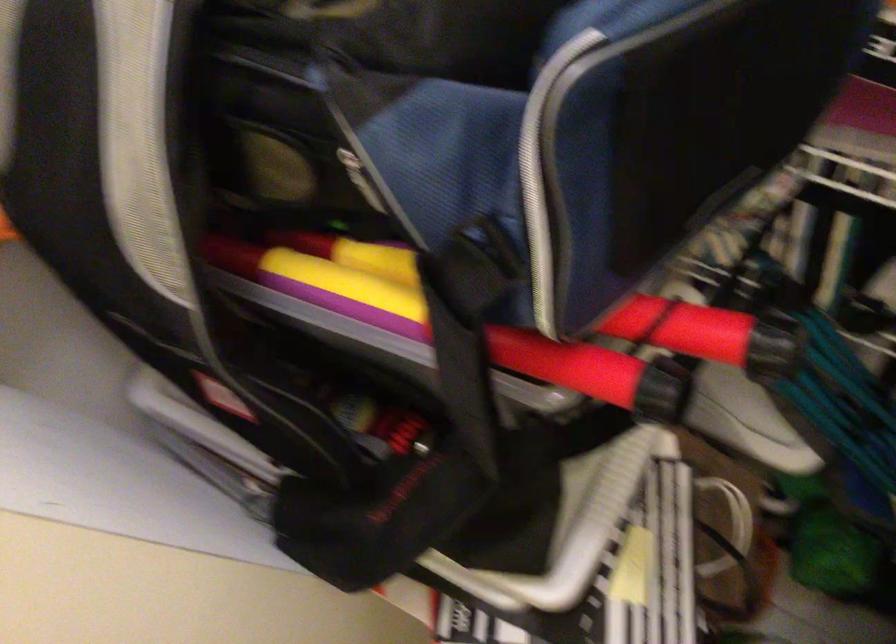
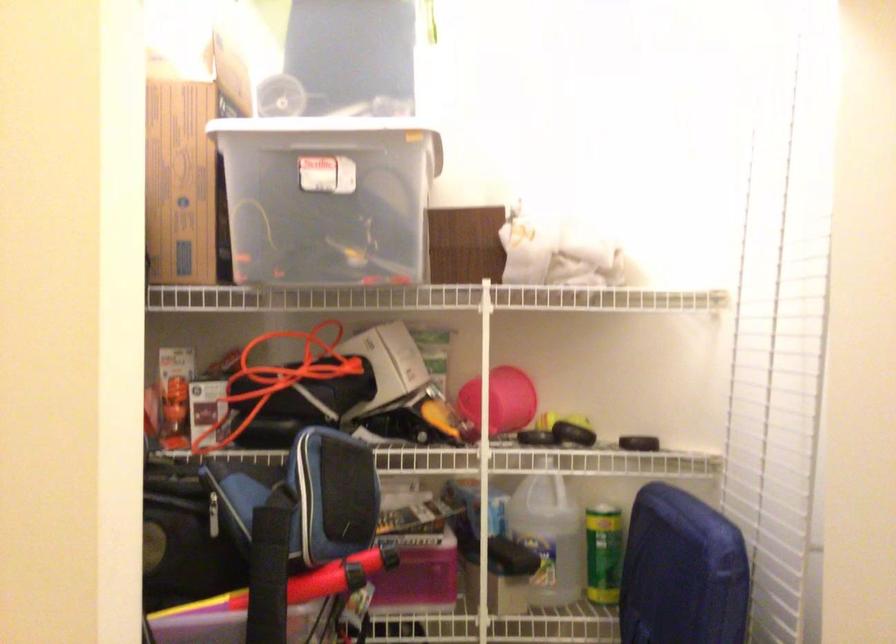
Find the pixel in the second image that matches [547,357] in the first image.

(298, 583)